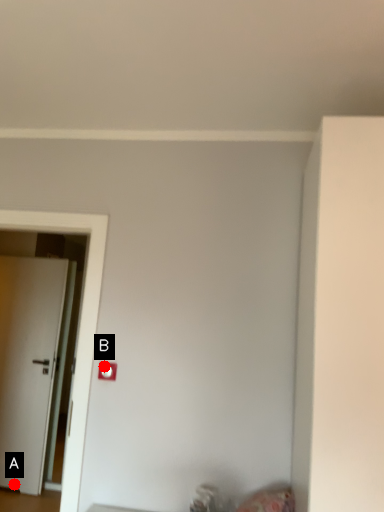
Question: Two points are circled on the image, labeled by A and B beside each circle. Which point is farther from the camera taking this photo?

Choices:
 (A) A is further
 (B) B is further

Answer: (A)